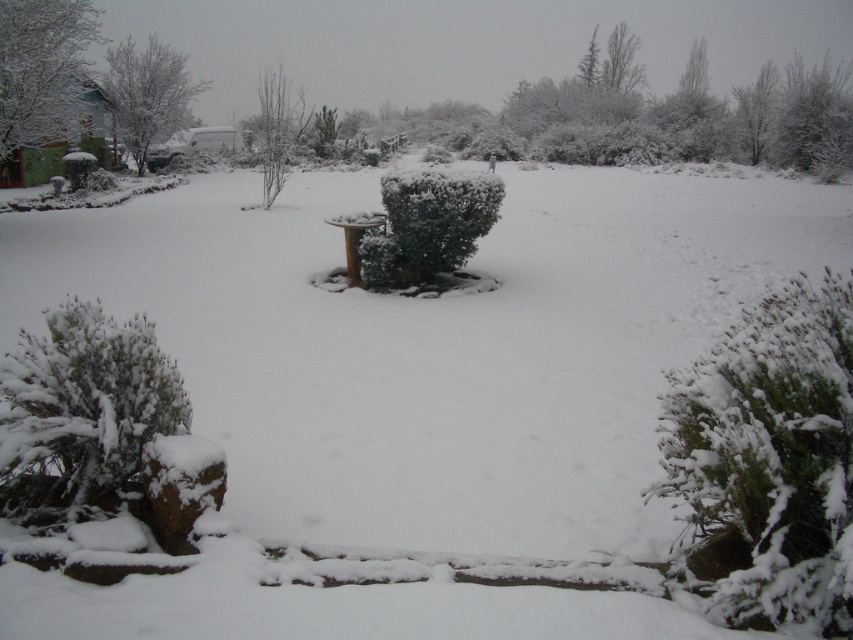
Which of these two, white fluffy bush at lower left or green leafy tree at upper center, stands taller?

With more height is white fluffy bush at lower left.

Who is positioned more to the left, white fluffy bush at lower left or green leafy tree at upper center?

white fluffy bush at lower left

At what (x,y) coordinates should I click in order to perform the action: click on white fluffy bush at lower left. Please return your answer as a coordinate pair (x, y). Looking at the image, I should click on (82, 412).

Who is more forward, (68, 44) or (595, 72)?

Point (68, 44) is in front.

Does point (41, 76) come farther from viewer compared to point (583, 60)?

No.

Find the location of a particular element. This screenshot has width=853, height=640. green matte house at upper left is located at coordinates (41, 67).

Based on the photo, does green matte house at upper left appear over bare branches at center?

Correct, green matte house at upper left is located above bare branches at center.

Does green matte house at upper left appear on the right side of bare branches at center?

In fact, green matte house at upper left is to the left of bare branches at center.

Between point (71, 38) and point (262, 129), which one is positioned behind?

Point (262, 129)

Image resolution: width=853 pixels, height=640 pixels. I want to click on green matte house at upper left, so click(x=41, y=67).